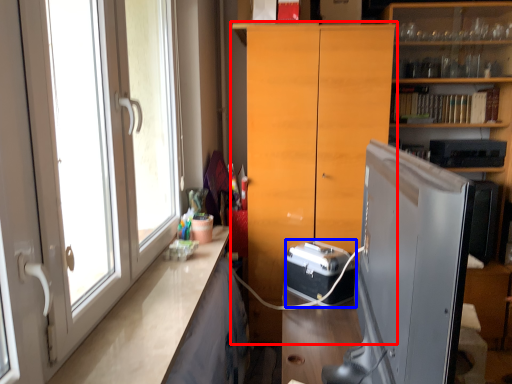
Question: Which point is closer to the camera, cabinetry (highlighted by a red box) or appliance (highlighted by a blue box)?

Choices:
 (A) cabinetry
 (B) appliance

Answer: (B)